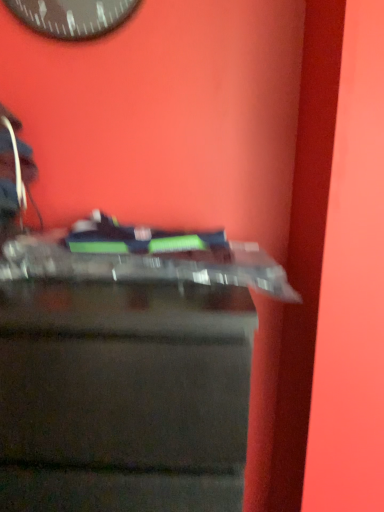
This screenshot has height=512, width=384. What do you see at coordinates (123, 397) in the screenshot? I see `transparent plastic container at center` at bounding box center [123, 397].

You are a GUI agent. You are given a task and a screenshot of the screen. Output one action in this format:
    pyautogui.click(x=<x>, y=<y>)
    Task: Click on the transparent plastic container at center
    This screenshot has width=384, height=512.
    Given the screenshot: What is the action you would take?
    pyautogui.click(x=123, y=397)

Locate an element on the screen. This screenshot has width=384, height=512. transparent plastic container at center is located at coordinates (123, 397).